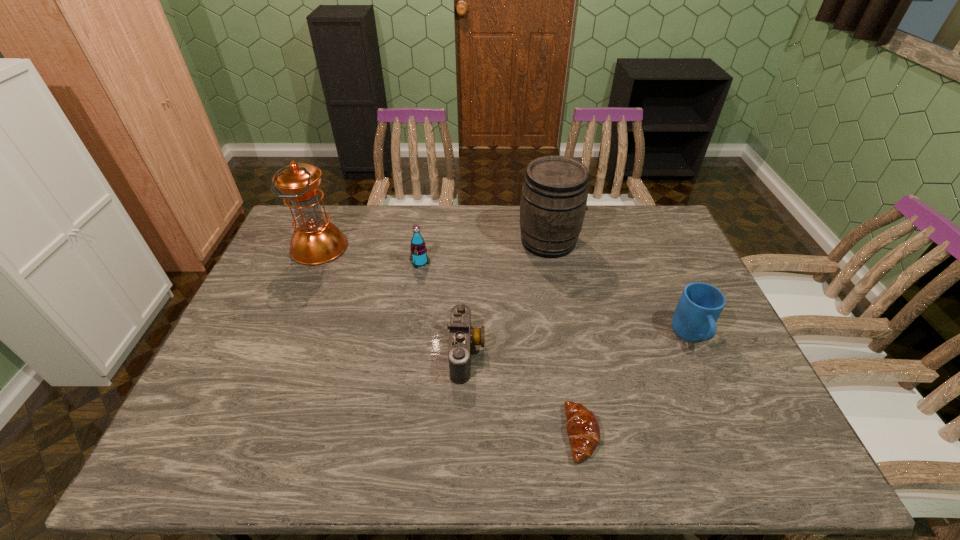
Locate an element on the screen. The width and height of the screenshot is (960, 540). blank space located 0.300m on the right of the wine bucket is located at coordinates (669, 241).

Find the location of a particular element. The height and width of the screenshot is (540, 960). free location located 0.060m on the front of the second object from left to right is located at coordinates (417, 282).

Where is `blank space located 0.170m on the side of the rightmost object with the handle`? This screenshot has height=540, width=960. blank space located 0.170m on the side of the rightmost object with the handle is located at coordinates (728, 417).

Find the location of `vacant position located on the lens of the camera`. vacant position located on the lens of the camera is located at coordinates (588, 353).

The image size is (960, 540). Find the location of `free space located on the right of the crescent roll`. free space located on the right of the crescent roll is located at coordinates (705, 434).

Where is `oil lamp that is at the far edge`? oil lamp that is at the far edge is located at coordinates (316, 241).

Find the location of a particular element. wine bucket that is at the far edge is located at coordinates (554, 196).

Locate an element on the screen. object that is at the near edge is located at coordinates (583, 429).

The width and height of the screenshot is (960, 540). Find the location of `object present at the left edge`. object present at the left edge is located at coordinates (316, 241).

At what (x,y) coordinates should I click in order to perform the action: click on object that is positioned at the right edge. Please return your answer as a coordinate pair (x, y). Looking at the image, I should click on (700, 305).